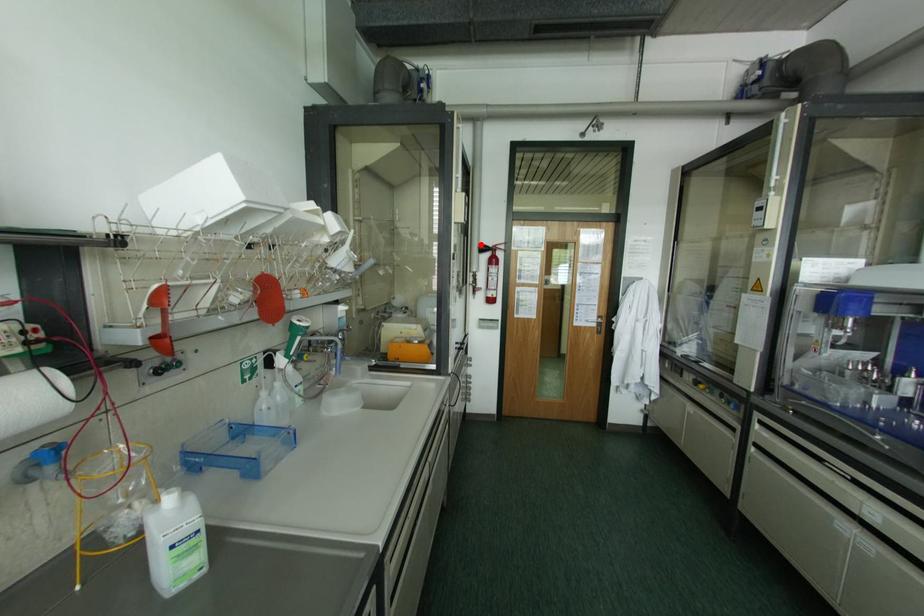
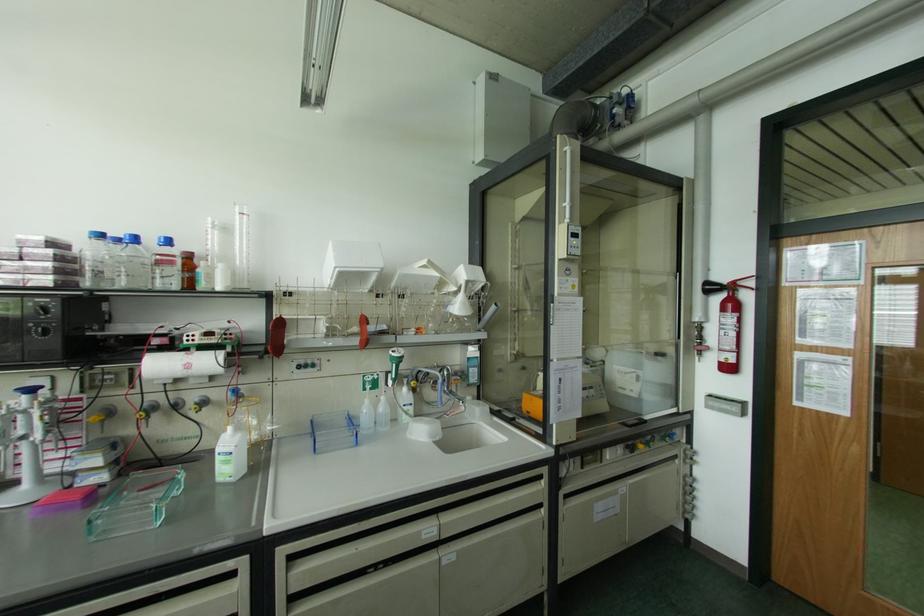
The point at the highlighted location is marked in the first image. Where is the corresponding point in the second image?

(707, 283)